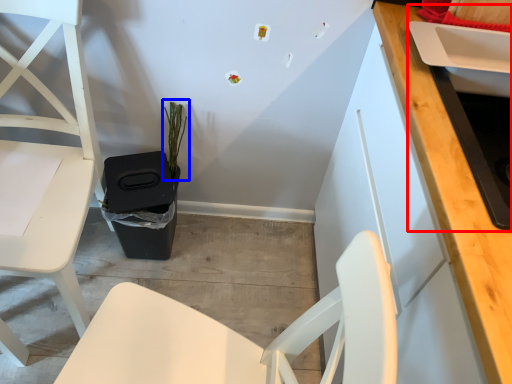
Question: Which of the following is the farthest to the observer, sink (highlighted by a red box) or plant (highlighted by a blue box)?

Choices:
 (A) sink
 (B) plant

Answer: (B)